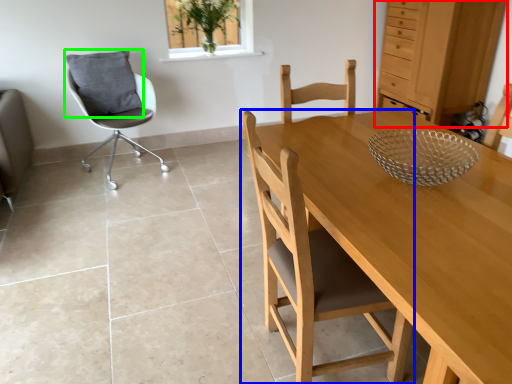
Question: Which object is the closest to the dresser (highlighted by a red box)? Choose among these: chair (highlighted by a blue box) or pillow (highlighted by a green box).

Choices:
 (A) chair
 (B) pillow

Answer: (B)